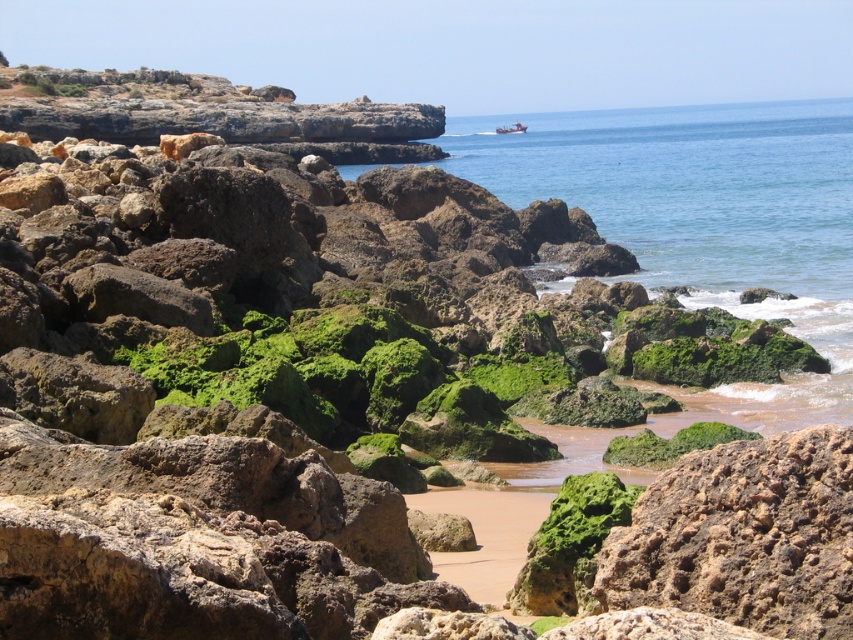
Can you confirm if green mossy rock at center is thinner than metallic red boat at center?

Yes, green mossy rock at center is thinner than metallic red boat at center.

Does green mossy rock at center appear on the right side of metallic red boat at center?

No, green mossy rock at center is not to the right of metallic red boat at center.

Is point (708, 442) behind point (505, 125)?

No, (708, 442) is closer to viewer.

Locate an element on the screen. Image resolution: width=853 pixels, height=640 pixels. green mossy rock at center is located at coordinates (670, 444).